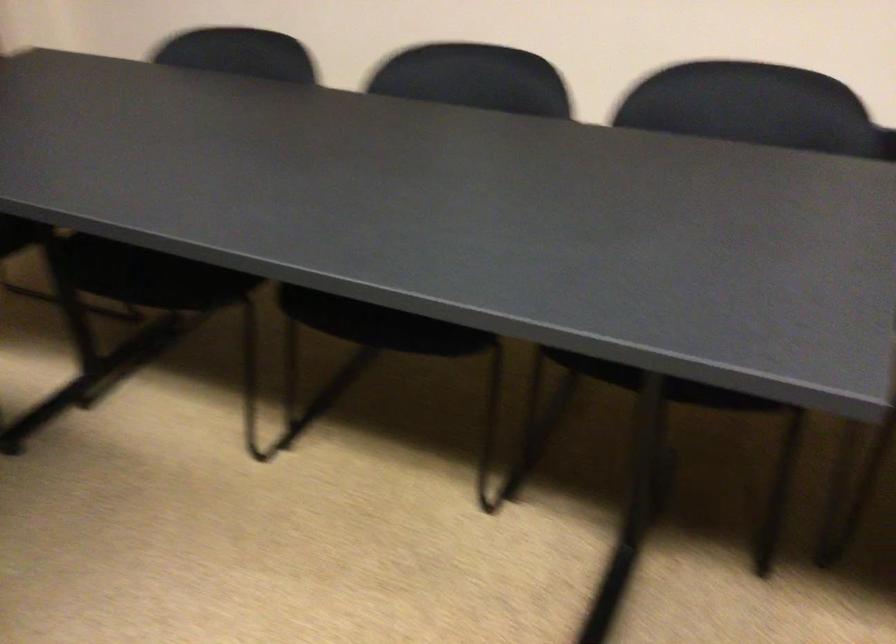
What do you see at coordinates (378, 324) in the screenshot? I see `a dark chair sitting surface` at bounding box center [378, 324].